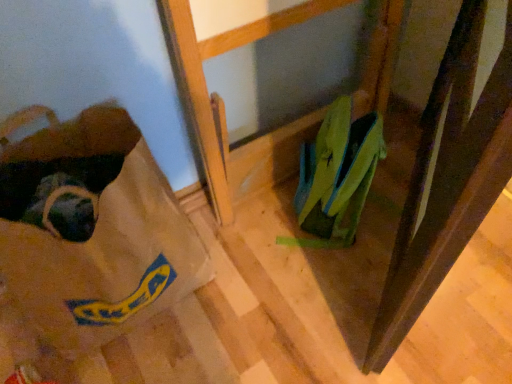
You are a GUI agent. You are given a task and a screenshot of the screen. Output one action in this format:
    pyautogui.click(x=<x>, y=<y>)
    Task: Click on the brown paper bag at lower left
    The width and height of the screenshot is (512, 384).
    Given the screenshot: What is the action you would take?
    pyautogui.click(x=92, y=231)

What do you see at coordinates (92, 231) in the screenshot? The image size is (512, 384). I see `brown paper bag at lower left` at bounding box center [92, 231].

What do you see at coordinates (336, 176) in the screenshot? The image size is (512, 384). I see `green fabric shoe at lower right` at bounding box center [336, 176].

Measure the distance between point (365,170) and camera.

Point (365,170) and camera are 3.28 feet apart.

You are a GUI agent. You are given a task and a screenshot of the screen. Output one action in this format:
    pyautogui.click(x=<x>, y=<y>)
    Task: Click on the green fabric shoe at lower right
    This screenshot has height=384, width=512.
    Given the screenshot: What is the action you would take?
    pyautogui.click(x=336, y=176)

The width and height of the screenshot is (512, 384). I want to click on brown paper bag at lower left, so click(x=92, y=231).

Is brown paper bag at lower left at the left side of green fabric shoe at lower right?

Yes.

Between brown paper bag at lower left and green fabric shoe at lower right, which one is positioned in front?

brown paper bag at lower left is more forward.

Between point (167, 232) and point (355, 229), which one is positioned in front?

Positioned in front is point (167, 232).

Based on the photo, from the image's perspective, is brown paper bag at lower left above or below green fabric shoe at lower right?

Clearly, from the image's perspective, brown paper bag at lower left is below green fabric shoe at lower right.

From a real-world perspective, is brown paper bag at lower left positioned under green fabric shoe at lower right based on gravity?

No, from a real-world perspective, brown paper bag at lower left is not below green fabric shoe at lower right.

Looking at their sizes, would you say brown paper bag at lower left is wider or thinner than green fabric shoe at lower right?

brown paper bag at lower left is wider than green fabric shoe at lower right.

Can you confirm if brown paper bag at lower left is taller than green fabric shoe at lower right?

Indeed, brown paper bag at lower left has a greater height compared to green fabric shoe at lower right.

Between brown paper bag at lower left and green fabric shoe at lower right, which one has larger size?

Bigger between the two is brown paper bag at lower left.

Would you say brown paper bag at lower left is outside green fabric shoe at lower right?

brown paper bag at lower left is positioned outside green fabric shoe at lower right.

Is brown paper bag at lower left in contact with green fabric shoe at lower right?

There is a gap between brown paper bag at lower left and green fabric shoe at lower right.

Is green fabric shoe at lower right at the back of brown paper bag at lower left?

No, brown paper bag at lower left's orientation is not away from green fabric shoe at lower right.

How far apart are brown paper bag at lower left and green fabric shoe at lower right?

They are 19.06 inches apart.

Where is `footwear directly beneath the brown paper bag at lower left (from a real-world perspective)`? footwear directly beneath the brown paper bag at lower left (from a real-world perspective) is located at coordinates (336, 176).

Based on their positions, is green fabric shoe at lower right located to the left or right of brown paper bag at lower left?

From the image, it's evident that green fabric shoe at lower right is to the right of brown paper bag at lower left.

From the picture: Is the position of green fabric shoe at lower right less distant than that of brown paper bag at lower left?

No, green fabric shoe at lower right is further to the viewer.

Does point (351, 185) lie behind point (119, 150)?

No, (351, 185) is in front of (119, 150).

From the image's perspective, is green fabric shoe at lower right beneath brown paper bag at lower left?

No.

From a real-world perspective, which object stands above the other?

From a 3D spatial view, brown paper bag at lower left is above.

Does green fabric shoe at lower right have a greater width compared to brown paper bag at lower left?

No, green fabric shoe at lower right is not wider than brown paper bag at lower left.

From their relative heights in the image, would you say green fabric shoe at lower right is taller or shorter than brown paper bag at lower left?

Considering their sizes, green fabric shoe at lower right has less height than brown paper bag at lower left.

Which of these two, green fabric shoe at lower right or brown paper bag at lower left, is smaller?

green fabric shoe at lower right is smaller.

Do you think green fabric shoe at lower right is within brown paper bag at lower left, or outside of it?

green fabric shoe at lower right exists outside the volume of brown paper bag at lower left.

Is green fabric shoe at lower right with brown paper bag at lower left?

green fabric shoe at lower right is not next to brown paper bag at lower left, and they're not touching.

Based on the photo, is green fabric shoe at lower right facing away from brown paper bag at lower left?

No, green fabric shoe at lower right is not facing the opposite direction of brown paper bag at lower left.

How different are the orientations of green fabric shoe at lower right and brown paper bag at lower left in degrees?

48.1 degrees.

Measure the distance between green fabric shoe at lower right and brown paper bag at lower left.

19.06 inches.

Find the location of a particular element. This screenshot has height=384, width=512. footwear above the brown paper bag at lower left (from the image's perspective) is located at coordinates (336, 176).

The image size is (512, 384). I want to click on grocery bag above the green fabric shoe at lower right (from a real-world perspective), so click(x=92, y=231).

This screenshot has height=384, width=512. In order to click on footwear behind the brown paper bag at lower left in this screenshot , I will do `click(336, 176)`.